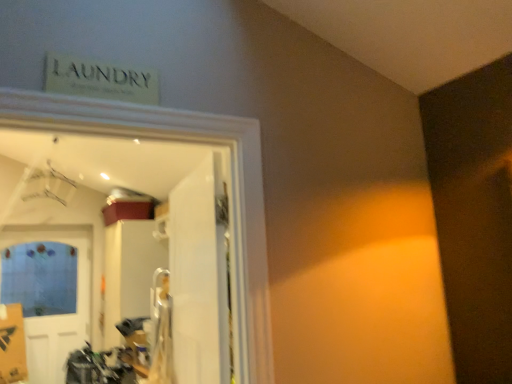
I want to click on white glossy door at center, positioned as the first door in right-to-left order, so click(x=199, y=275).

This screenshot has width=512, height=384. Describe the element at coordinates (199, 275) in the screenshot. I see `white glossy door at center, which is the second door in back-to-front order` at that location.

What do you see at coordinates (57, 315) in the screenshot? The width and height of the screenshot is (512, 384). I see `blue matte door at lower left, the first door in the left-to-right sequence` at bounding box center [57, 315].

I want to click on blue matte door at lower left, which is the 1th door in back-to-front order, so click(x=57, y=315).

Find the location of `white glossy door at center, which is the first door in front-to-back order`. white glossy door at center, which is the first door in front-to-back order is located at coordinates (199, 275).

In the image, is blue matte door at lower left, which is the 2th door from right to left, on the left side or the right side of white glossy door at center, which is the second door in back-to-front order?

Based on their positions, blue matte door at lower left, which is the 2th door from right to left, is located to the left of white glossy door at center, which is the second door in back-to-front order.

Consider the image. Which is behind, blue matte door at lower left, which is the 2th door from right to left, or white glossy door at center, which is the second door from left to right?

blue matte door at lower left, which is the 2th door from right to left, is more distant.

Does point (69, 341) lie behind point (173, 319)?

Yes, point (69, 341) is farther from viewer.

From the image's perspective, which is above, blue matte door at lower left, which ranks as the second door in front-to-back order, or white glossy door at center, which is the second door from left to right?

white glossy door at center, which is the second door from left to right.

Based on the photo, from a real-world perspective, is blue matte door at lower left, the first door in the left-to-right sequence, over white glossy door at center, which is the first door in front-to-back order?

No, from a real-world perspective, blue matte door at lower left, the first door in the left-to-right sequence, is not over white glossy door at center, which is the first door in front-to-back order

Can you confirm if blue matte door at lower left, which is the 2th door from right to left, is wider than white glossy door at center, which is the second door in back-to-front order?

In fact, blue matte door at lower left, which is the 2th door from right to left, might be narrower than white glossy door at center, which is the second door in back-to-front order.

Does blue matte door at lower left, which is the 2th door from right to left, have a greater height compared to white glossy door at center, which is the first door in front-to-back order?

Correct, blue matte door at lower left, which is the 2th door from right to left, is much taller as white glossy door at center, which is the first door in front-to-back order.

Is blue matte door at lower left, the first door in the left-to-right sequence, bigger than white glossy door at center, positioned as the first door in right-to-left order?

Yes, blue matte door at lower left, the first door in the left-to-right sequence, is bigger than white glossy door at center, positioned as the first door in right-to-left order.

Can we say blue matte door at lower left, which ranks as the second door in front-to-back order, lies outside white glossy door at center, which is the first door in front-to-back order?

That's correct, blue matte door at lower left, which ranks as the second door in front-to-back order, is outside of white glossy door at center, which is the first door in front-to-back order.

Are blue matte door at lower left, which ranks as the second door in front-to-back order, and white glossy door at center, which is the first door in front-to-back order, beside each other?

No, blue matte door at lower left, which ranks as the second door in front-to-back order, is not next to white glossy door at center, which is the first door in front-to-back order.

In the scene shown: Is blue matte door at lower left, which is the 2th door from right to left, aimed at white glossy door at center, which is the second door in back-to-front order?

Yes, blue matte door at lower left, which is the 2th door from right to left, is oriented towards white glossy door at center, which is the second door in back-to-front order.

In the scene shown: How far apart are blue matte door at lower left, which is the 2th door from right to left, and white glossy door at center, which is the first door in front-to-back order?

3.09 meters.

Locate an element on the screen. door behind the white glossy door at center, positioned as the first door in right-to-left order is located at coordinates (57, 315).

Between white glossy door at center, which is the second door from left to right, and blue matte door at lower left, which is the 1th door in back-to-front order, which one appears on the left side from the viewer's perspective?

From the viewer's perspective, blue matte door at lower left, which is the 1th door in back-to-front order, appears more on the left side.

Which object is further away from the camera, white glossy door at center, which is the second door from left to right, or blue matte door at lower left, which is the 2th door from right to left?

blue matte door at lower left, which is the 2th door from right to left, is further away from the camera.

Does point (176, 328) appear closer or farther from the camera than point (54, 349)?

Point (176, 328).

From the image's perspective, between white glossy door at center, which is the second door from left to right, and blue matte door at lower left, which is the 2th door from right to left, which one is located above?

white glossy door at center, which is the second door from left to right, is shown above in the image.

From a real-world perspective, who is located higher, white glossy door at center, positioned as the first door in right-to-left order, or blue matte door at lower left, which is the 1th door in back-to-front order?

white glossy door at center, positioned as the first door in right-to-left order, is physically above.

Based on the photo, between white glossy door at center, positioned as the first door in right-to-left order, and blue matte door at lower left, which is the 2th door from right to left, which one has larger width?

white glossy door at center, positioned as the first door in right-to-left order, is wider.

Considering the sizes of objects white glossy door at center, which is the first door in front-to-back order, and blue matte door at lower left, which is the 1th door in back-to-front order, in the image provided, who is shorter, white glossy door at center, which is the first door in front-to-back order, or blue matte door at lower left, which is the 1th door in back-to-front order,?

With less height is white glossy door at center, which is the first door in front-to-back order.

Can you confirm if white glossy door at center, which is the second door from left to right, is smaller than blue matte door at lower left, which is the 1th door in back-to-front order?

Yes.

Looking at this image, is white glossy door at center, which is the first door in front-to-back order, inside or outside of blue matte door at lower left, which is the 1th door in back-to-front order?

white glossy door at center, which is the first door in front-to-back order, lies outside blue matte door at lower left, which is the 1th door in back-to-front order.

Does white glossy door at center, which is the first door in front-to-back order, touch blue matte door at lower left, which ranks as the second door in front-to-back order?

No, white glossy door at center, which is the first door in front-to-back order, is not making contact with blue matte door at lower left, which ranks as the second door in front-to-back order.

Could you tell me if white glossy door at center, positioned as the first door in right-to-left order, is turned towards blue matte door at lower left, which ranks as the second door in front-to-back order?

No, white glossy door at center, positioned as the first door in right-to-left order, does not turn towards blue matte door at lower left, which ranks as the second door in front-to-back order.

How different are the orientations of white glossy door at center, positioned as the first door in right-to-left order, and blue matte door at lower left, which ranks as the second door in front-to-back order, in degrees?

white glossy door at center, positioned as the first door in right-to-left order, and blue matte door at lower left, which ranks as the second door in front-to-back order, are facing 99.3 degrees away from each other.

How far apart are white glossy door at center, which is the second door in back-to-front order, and blue matte door at lower left, which ranks as the second door in front-to-back order?

They are 10.14 feet apart.

This screenshot has height=384, width=512. Find the location of `door that is above the blue matte door at lower left, the first door in the left-to-right sequence (from a real-world perspective)`. door that is above the blue matte door at lower left, the first door in the left-to-right sequence (from a real-world perspective) is located at coordinates (199, 275).

Where is `door lying above the blue matte door at lower left, the first door in the left-to-right sequence (from the image's perspective)`? This screenshot has height=384, width=512. door lying above the blue matte door at lower left, the first door in the left-to-right sequence (from the image's perspective) is located at coordinates (199, 275).

Locate an element on the screen. door on the right of the blue matte door at lower left, which is the 1th door in back-to-front order is located at coordinates (199, 275).